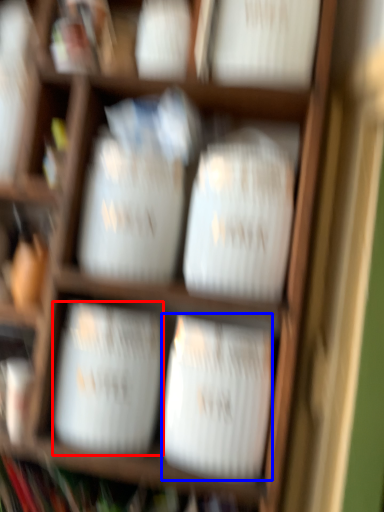
Question: Which object is closer to the camera taking this photo, wide (highlighted by a red box) or wide (highlighted by a blue box)?

Choices:
 (A) wide
 (B) wide

Answer: (B)